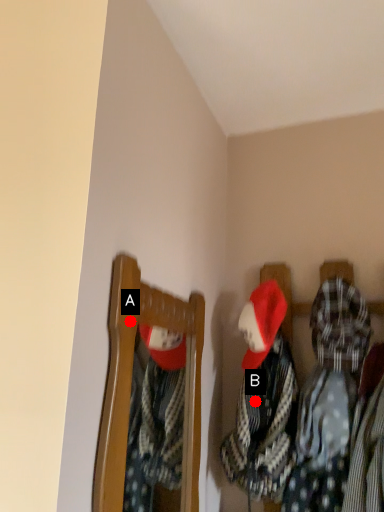
Question: Two points are circled on the image, labeled by A and B beside each circle. Which point is further to the camera?

Choices:
 (A) A is further
 (B) B is further

Answer: (B)